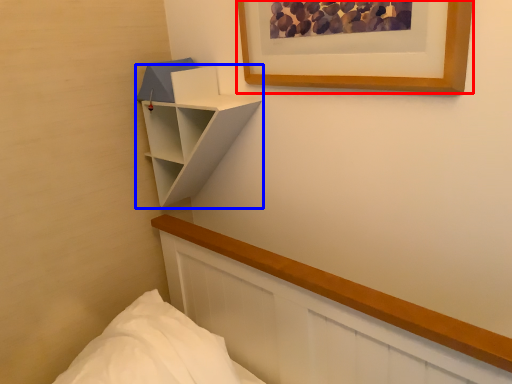
Question: Which object is further to the camera taking this photo, picture frame (highlighted by a red box) or shelf (highlighted by a blue box)?

Choices:
 (A) picture frame
 (B) shelf

Answer: (B)